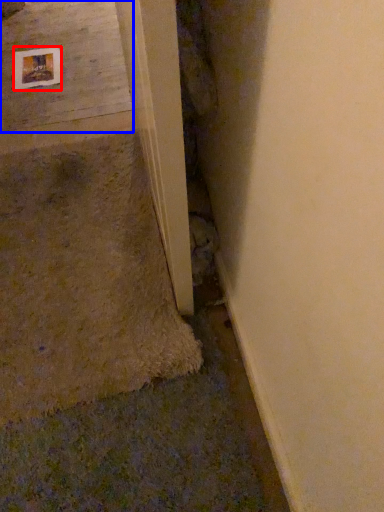
Question: Which object appears farthest to the camera in this image, picture frame (highlighted by a red box) or concrete (highlighted by a blue box)?

Choices:
 (A) picture frame
 (B) concrete

Answer: (A)